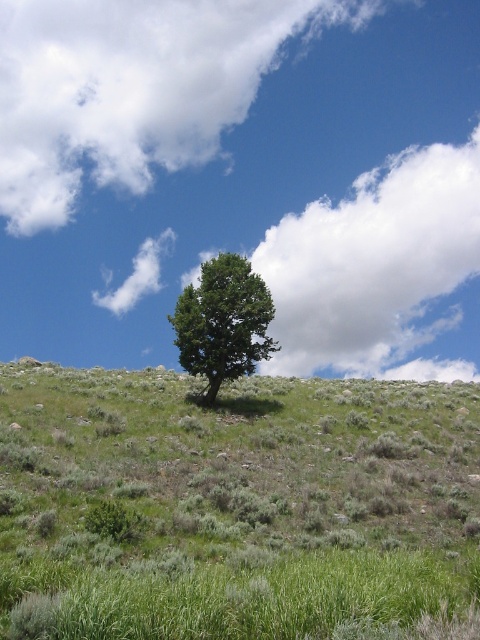
You are an observer looking at the landscape. Which object, the white fluffy cloud at upper center or the green leafy tree at center, is higher up in the sky?

The white fluffy cloud at upper center is taller than the green leafy tree at center, so the white fluffy cloud at upper center is higher up in the sky.

You are a hiker who wants to cross the green grassy hillside at center. You notice the green leafy tree at center is in the middle of your path. Can you walk around the tree without leaving the hillside?

The green grassy hillside at center is wider than the green leafy tree at center, so yes, you can walk around the tree while staying on the hillside.

You are a hiker who wants to set up a tent on the green grassy hillside at center. However, you notice the green leafy tree at center is directly above it. Will the tree provide sufficient shade for your tent during midday?

The green grassy hillside at center is positioned under green leafy tree at center, so yes, the tree will provide shade for the tent during midday.